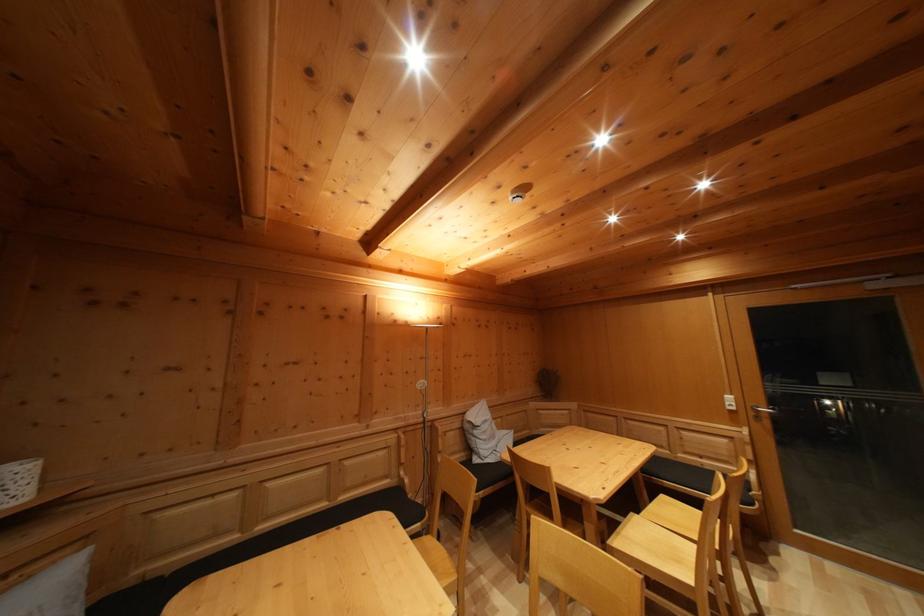
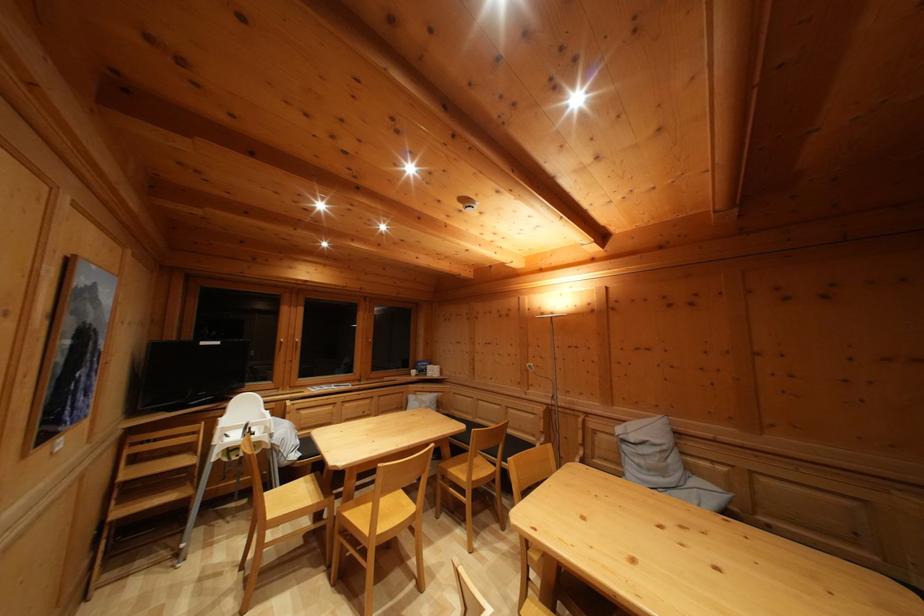
Locate, in the second image, the point that corresponds to (480,439) in the first image.

(629, 454)